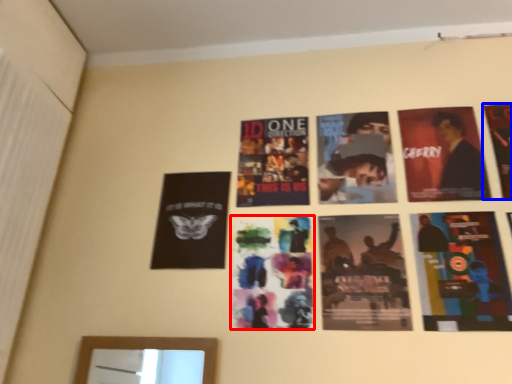
Question: Which object is further to the camera taking this photo, poster (highlighted by a red box) or poster (highlighted by a blue box)?

Choices:
 (A) poster
 (B) poster

Answer: (B)